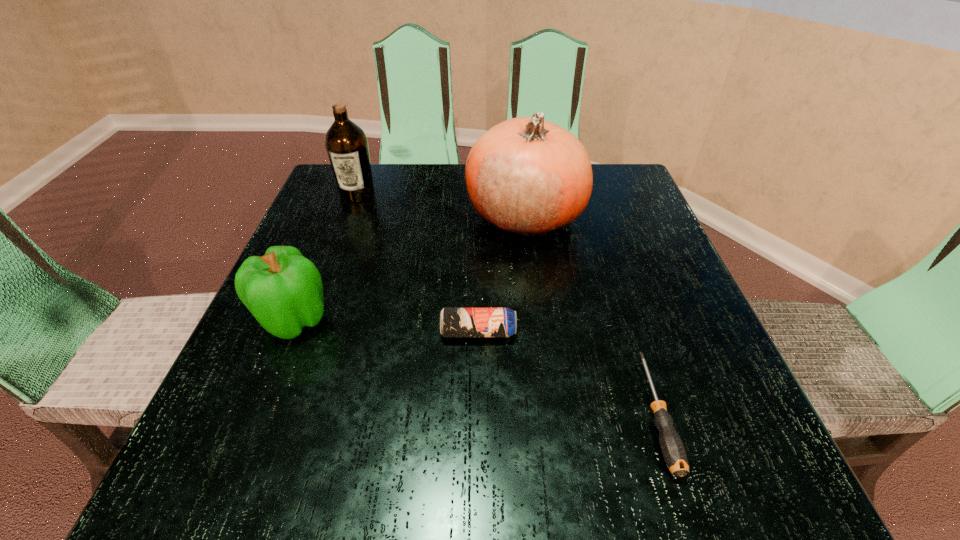
Locate an element on the screen. free space between the bell pepper and the olive oil is located at coordinates (325, 256).

Identify the location of empty space that is in between the third shortest object and the beer can. The width and height of the screenshot is (960, 540). (386, 326).

Where is `unoccupied position between the beer can and the pumpkin`? The image size is (960, 540). unoccupied position between the beer can and the pumpkin is located at coordinates pyautogui.click(x=501, y=273).

The image size is (960, 540). I want to click on blank region between the screwdriver and the pumpkin, so click(x=590, y=313).

I want to click on vacant region between the pumpkin and the screwdriver, so click(590, 313).

Where is `unoccupied area between the shortest object and the third shortest object`? This screenshot has height=540, width=960. unoccupied area between the shortest object and the third shortest object is located at coordinates (475, 366).

Image resolution: width=960 pixels, height=540 pixels. I want to click on free space between the shortest object and the second shortest object, so click(567, 373).

Identify which object is located as the third nearest to the third shortest object. Please provide its 2D coordinates. Your answer should be formatted as a tuple, i.e. [(x, y)], where the tuple contains the x and y coordinates of a point satisfying the conditions above.

[(346, 143)]

Identify which object is the third nearest to the rightmost object. Please provide its 2D coordinates. Your answer should be formatted as a tuple, i.e. [(x, y)], where the tuple contains the x and y coordinates of a point satisfying the conditions above.

[(283, 290)]

Where is `vacant space that satisfies the following two spatial constraints: 1. on the label of the olive oil; 2. on the left side of the second shortest object`? The height and width of the screenshot is (540, 960). vacant space that satisfies the following two spatial constraints: 1. on the label of the olive oil; 2. on the left side of the second shortest object is located at coordinates (306, 332).